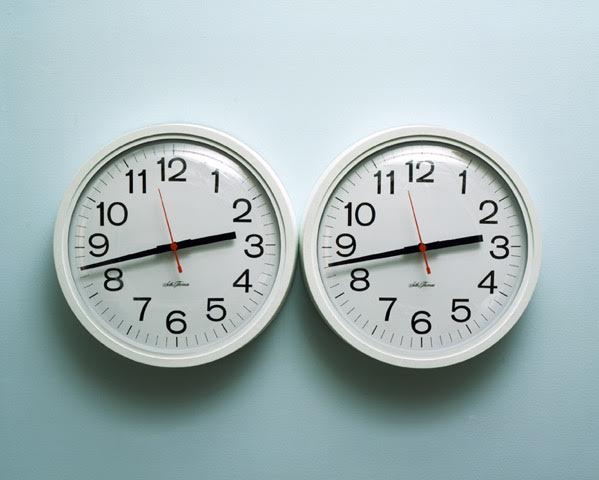
Find the location of a particular element. This screenshot has height=480, width=599. clock hands is located at coordinates (413, 211), (117, 258), (374, 256), (165, 213).